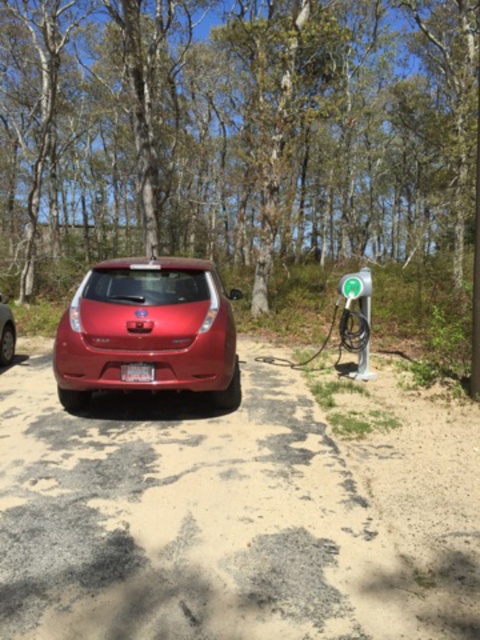
You are standing on the driveway and want to take a photo of both the glossy red car at center and the shiny red car at center. Which car should you focus on first to ensure it appears sharp in the photo?

You should focus on the glossy red car at center first because it is closer to you than the shiny red car at center, so focusing on it will ensure it appears sharp while the other may be slightly blurred due to depth of field limitations.

You are a delivery driver who needs to park your vehicle near the green plastic parking meter at center. Given the coordinates provided, can you determine if the parking meter is positioned in the center of the driveway?

The green plastic parking meter at center is located at point 0.455 on the x and 0.746 on the y axis. Since the coordinates are given as a point, it is positioned exactly at the center of the driveway.

You are a delivery driver who needs to park your vehicle in the driveway. The glossy red car at center is currently occupying the space. Can you park your vehicle next to the green plastic parking meter at center without overlapping them?

The glossy red car at center is larger than the green plastic parking meter at center. Since the driveway is gravel and surrounded by trees, there might be limited space. However, the exact dimensions aren